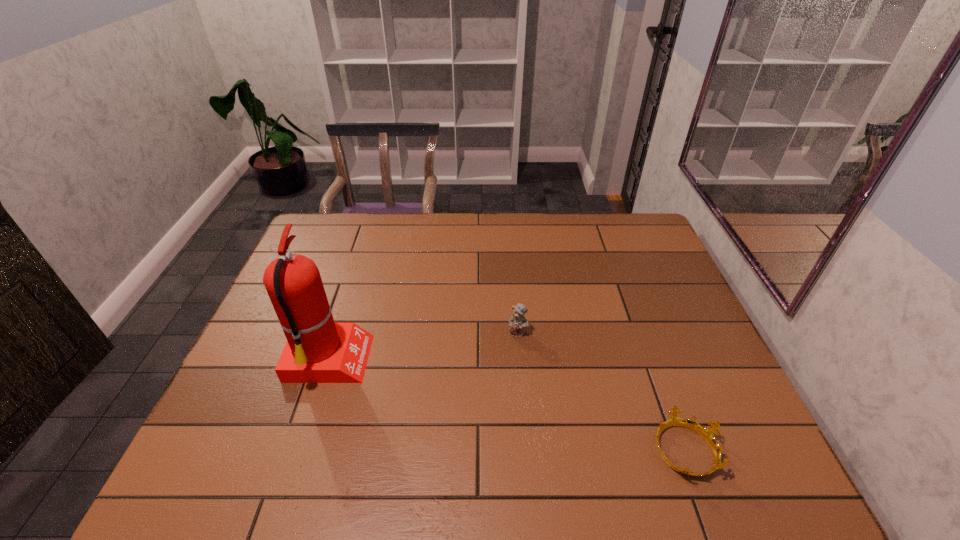
Where is `vacant space that satisfies the following two spatial constraints: 1. on the front-facing side of the second tallest object; 2. on the right side of the nearest object`? vacant space that satisfies the following two spatial constraints: 1. on the front-facing side of the second tallest object; 2. on the right side of the nearest object is located at coordinates (528, 449).

Image resolution: width=960 pixels, height=540 pixels. I want to click on vacant space that satisfies the following two spatial constraints: 1. on the front-facing side of the second shortest object; 2. on the front-facing side of the leftmost object, so click(520, 362).

What are the coordinates of `vacant space that satisfies the following two spatial constraints: 1. on the front-facing side of the rightmost object; 2. on the right side of the tallest object` in the screenshot? It's located at (300, 449).

This screenshot has width=960, height=540. In order to click on vacant region that satisfies the following two spatial constraints: 1. on the front-facing side of the second shortest object; 2. on the front-facing side of the fire extinguisher in this screenshot , I will do 520,362.

At what (x,y) coordinates should I click in order to perform the action: click on vacant space that satisfies the following two spatial constraints: 1. on the front-facing side of the teddy bear; 2. on the left side of the shortest object. Please return your answer as a coordinate pair (x, y). The height and width of the screenshot is (540, 960). Looking at the image, I should click on (528, 449).

Find the location of `vacant region that satisfies the following two spatial constraints: 1. on the front-facing side of the second tallest object; 2. on the front-facing side of the leftmost object`. vacant region that satisfies the following two spatial constraints: 1. on the front-facing side of the second tallest object; 2. on the front-facing side of the leftmost object is located at coordinates (520, 362).